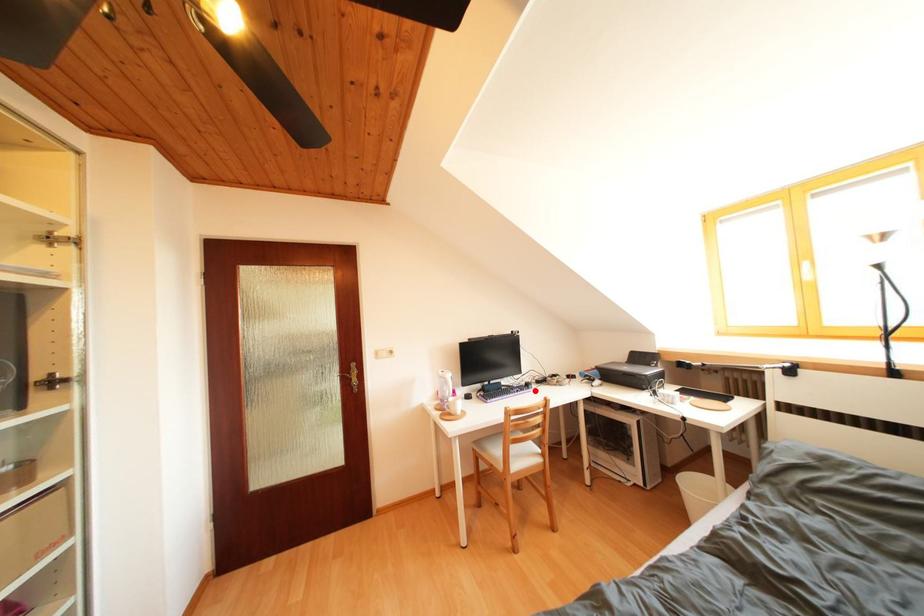
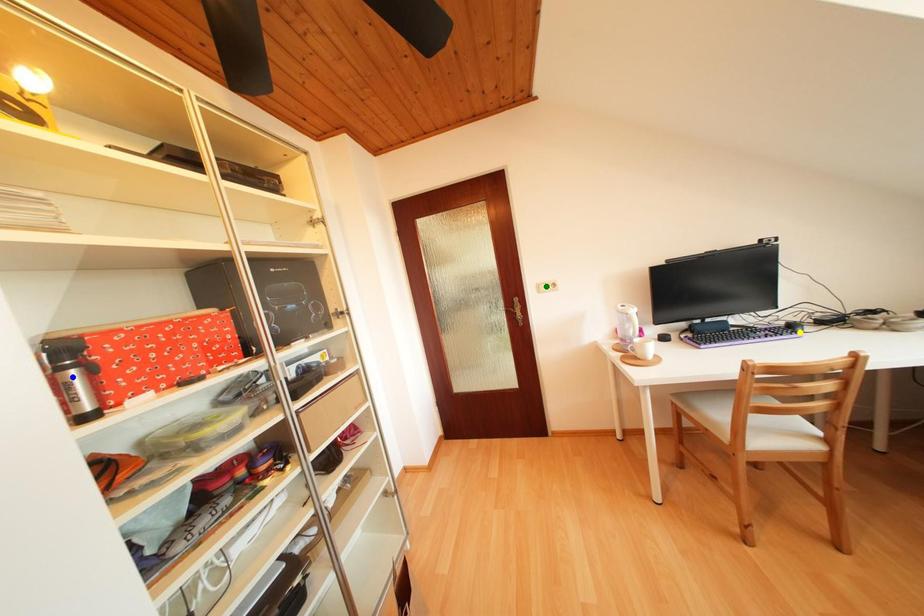
Question: I am providing you with two images of the same scene from different viewpoints. A red point is marked on the first image. You are given multiple points on the second image. Which spot in image 2 lines up with the point in image 1?

Choices:
 (A) blue point
 (B) green point
 (C) yellow point

Answer: (C)